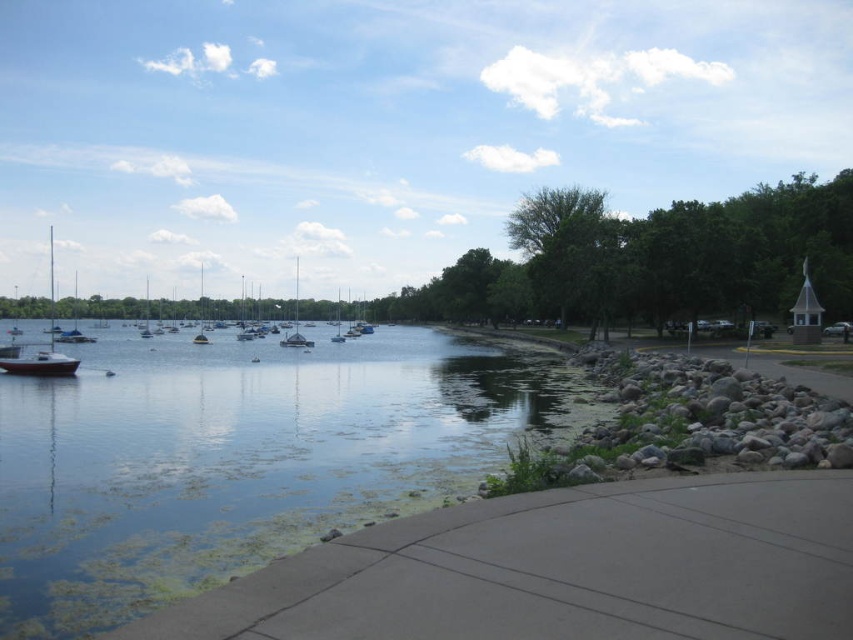
Who is positioned more to the right, matte white sailboat at left or white glossy sailboat at center?

From the viewer's perspective, white glossy sailboat at center appears more on the right side.

Can you confirm if matte white sailboat at left is taller than white glossy sailboat at center?

Yes.

Who is more forward, (53, 365) or (294, 346)?

Point (53, 365)

Where is `matte white sailboat at left`? matte white sailboat at left is located at coordinates (44, 348).

Is point (28, 586) closer to camera compared to point (39, 360)?

Yes, it is in front of point (39, 360).

Which is in front, point (312, 413) or point (51, 333)?

Point (312, 413) is in front.

Image resolution: width=853 pixels, height=640 pixels. I want to click on green algae-covered water at center, so click(239, 458).

Does green algae-covered water at center appear over white glossy sailboat at center?

No, green algae-covered water at center is not above white glossy sailboat at center.

Between green algae-covered water at center and white glossy sailboat at center, which one is positioned higher?

white glossy sailboat at center is above.

The height and width of the screenshot is (640, 853). I want to click on green algae-covered water at center, so click(x=239, y=458).